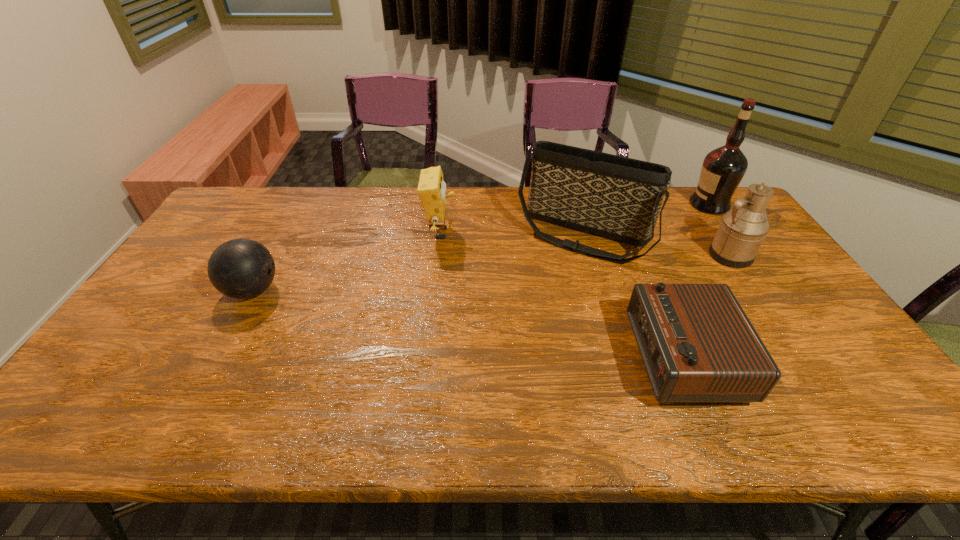
I want to click on sponge located in the far edge section of the desktop, so 431,189.

Find the location of a particular element. The height and width of the screenshot is (540, 960). object that is at the near edge is located at coordinates (697, 344).

The width and height of the screenshot is (960, 540). Find the location of `liquor situated at the right edge`. liquor situated at the right edge is located at coordinates (722, 170).

This screenshot has width=960, height=540. I want to click on pitcher that is at the right edge, so click(x=742, y=230).

Where is `object at the far right corner`? The image size is (960, 540). object at the far right corner is located at coordinates (722, 170).

Locate an element on the screen. This screenshot has width=960, height=540. vacant space at the far edge is located at coordinates (363, 207).

Locate an element on the screen. The image size is (960, 540). vacant point at the near edge is located at coordinates (570, 411).

In the image, there is a desktop. Where is `vacant space at the left edge`? vacant space at the left edge is located at coordinates coord(85,397).

Where is `vacant space at the right edge of the desktop`? This screenshot has height=540, width=960. vacant space at the right edge of the desktop is located at coordinates (779, 306).

Find the location of a particular element. The image size is (960, 540). free space at the far left corner is located at coordinates (249, 215).